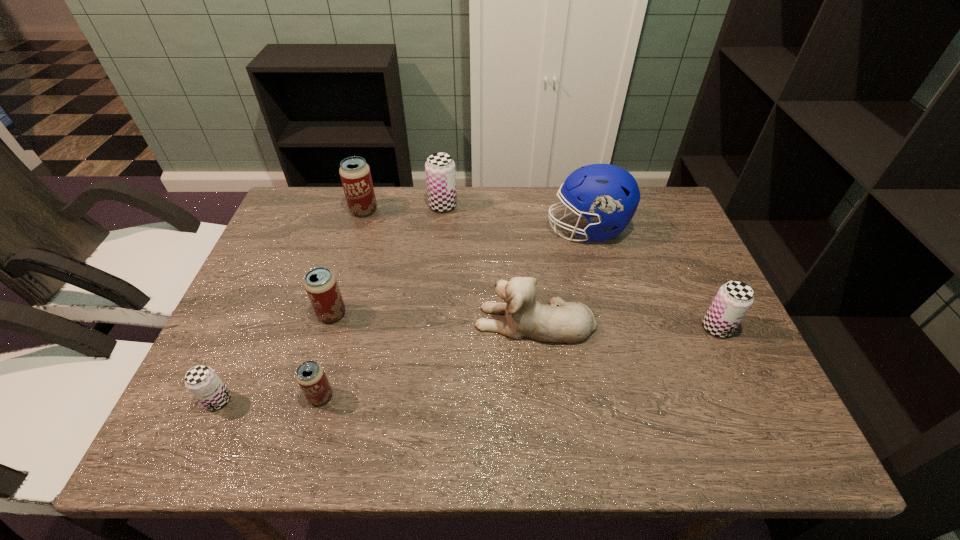
Locate which red beer can ranks second in proximity to the leftmost object. Please provide its 2D coordinates. Your answer should be formatted as a tuple, i.e. [(x, y)], where the tuple contains the x and y coordinates of a point satisfying the conditions above.

[(321, 285)]

This screenshot has height=540, width=960. What are the coordinates of `red beer can identified as the closest to the farthest red beer can` in the screenshot? It's located at click(x=321, y=285).

Where is `purple beer can identified as the closest to the biggest red beer can`? purple beer can identified as the closest to the biggest red beer can is located at coordinates (440, 168).

Select which purple beer can appears as the second closest to the second biggest purple beer can. Please provide its 2D coordinates. Your answer should be formatted as a tuple, i.e. [(x, y)], where the tuple contains the x and y coordinates of a point satisfying the conditions above.

[(202, 381)]

The width and height of the screenshot is (960, 540). What are the coordinates of `free space that satisfies the following two spatial constraints: 1. on the back side of the leftmost beer can; 2. on the left side of the farthest red beer can` in the screenshot? It's located at (304, 210).

Identify the location of free spot that satisfies the following two spatial constraints: 1. on the front-facing side of the blue football helmet; 2. on the front side of the second biggest red beer can. This screenshot has width=960, height=540. (610, 314).

The width and height of the screenshot is (960, 540). In order to click on vacant region that satisfies the following two spatial constraints: 1. on the front-facing side of the rightmost purple beer can; 2. on the right side of the blue football helmet in this screenshot , I will do `click(613, 328)`.

The height and width of the screenshot is (540, 960). Identify the location of free space that satisfies the following two spatial constraints: 1. on the front-facing side of the white puppy; 2. on the left side of the rightmost purple beer can. (536, 328).